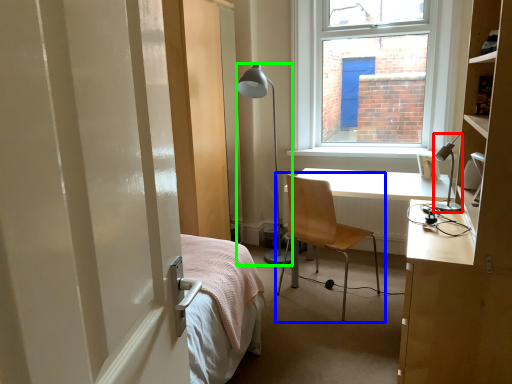
Question: Considering the real-world distances, which object is farthest from lamp (highlighted by a red box)? chair (highlighted by a blue box) or lamp (highlighted by a green box)?

Choices:
 (A) chair
 (B) lamp

Answer: (B)